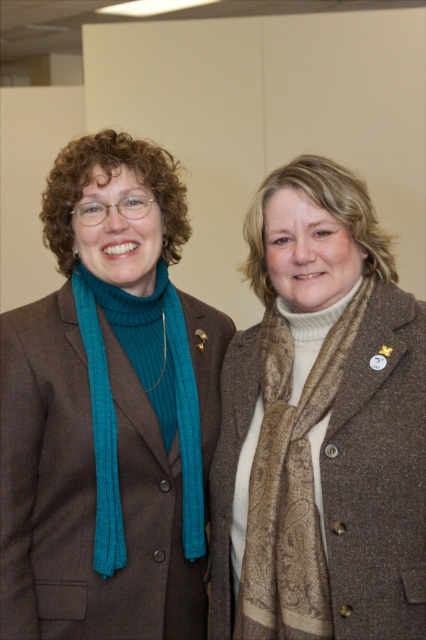
You are a fashion designer observing two scarves worn by the woman on the left. The scarves are labeled as the teal knitted scarf at left and the teal ribbed scarf at left. Which of these two scarves has a greater vertical height?

The teal knitted scarf at left is taller than the teal ribbed scarf at left.

You are a photographer setting up a shoot in the scene described. You need to position a light source so that it illuminates both the teal knitted scarf at left and the brown paisley scarf at center without casting shadows between them. Given their heights, which scarf should be placed closer to the light source?

The teal knitted scarf at left is taller than the brown paisley scarf at center, so to avoid shadows between them, the taller teal knitted scarf at left should be placed closer to the light source. This ensures the light can reach both scarves adequately without one casting a shadow on the other.